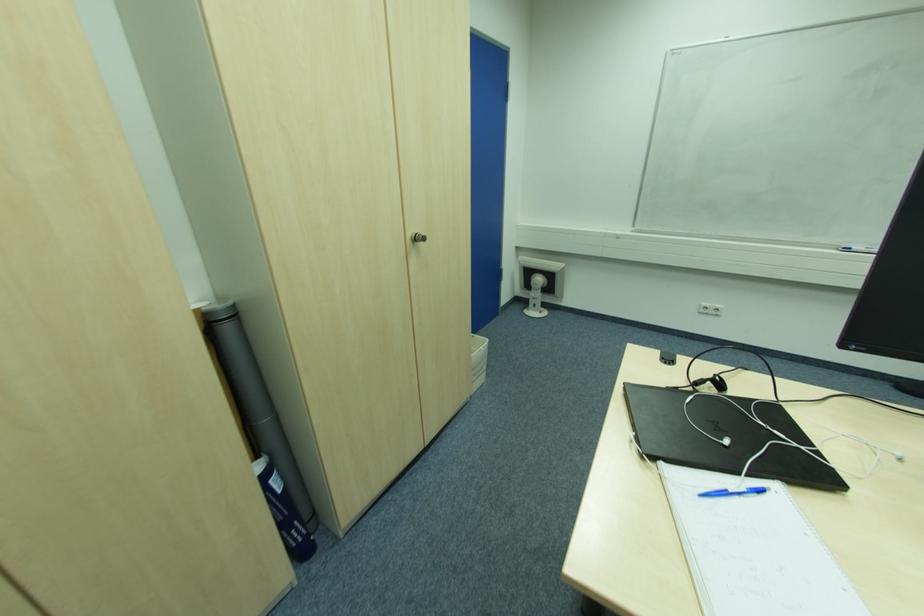
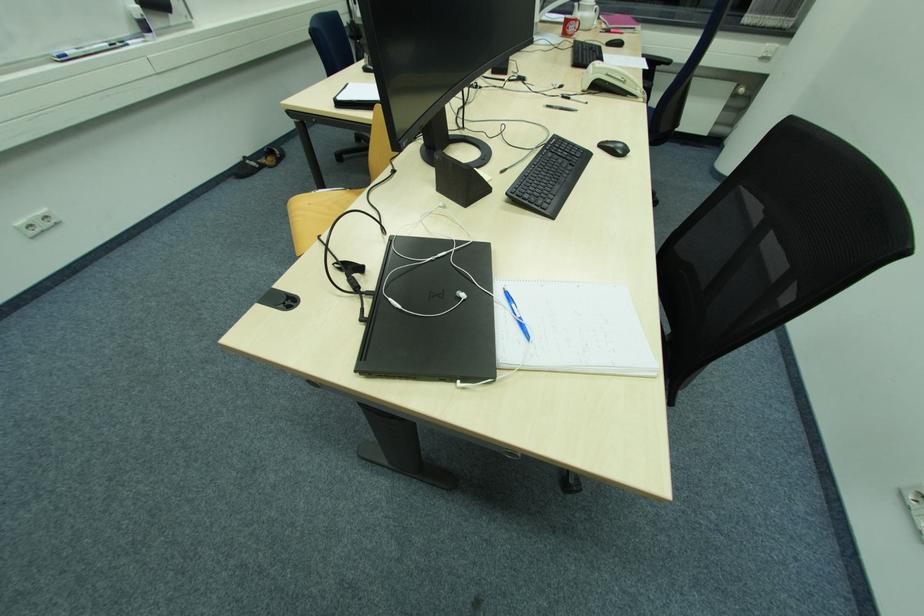
The images are taken continuously from a first-person perspective. In which direction is your viewpoint rotating?

The camera rotated toward right-down.